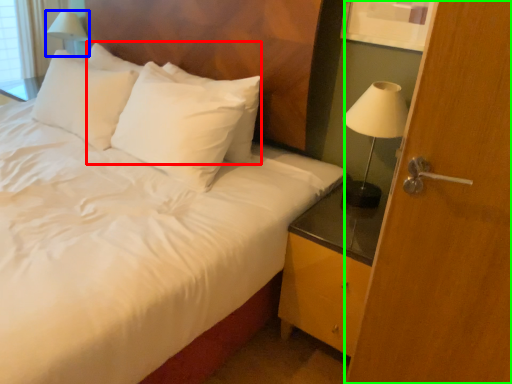
Question: Estimate the real-world distances between objects in this image. Which object is closer to pillow (highlighted by a red box), table lamp (highlighted by a blue box) or screen door (highlighted by a green box)?

Choices:
 (A) table lamp
 (B) screen door

Answer: (B)